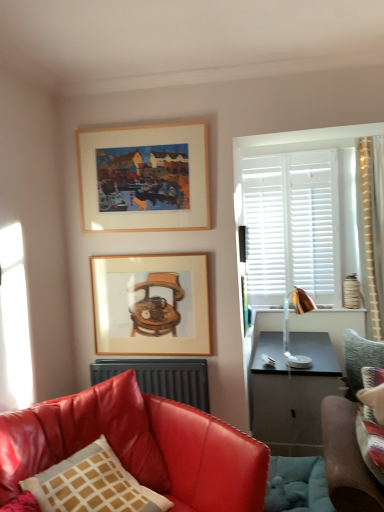
Question: In terms of height, does wooden frame at upper center, acting as the first picture frame starting from the top, look taller or shorter compared to shiny leather couch at lower left, which is the second studio couch from right to left?

Choices:
 (A) short
 (B) tall

Answer: (A)

Question: Visually, is wooden frame at upper center, acting as the first picture frame starting from the top, positioned to the left or to the right of shiny leather couch at lower left, the 1th studio couch when ordered from left to right?

Choices:
 (A) left
 (B) right

Answer: (B)

Question: Considering the real-world distances, which object is closest to the wooden framed picture at center, acting as the 1th picture frame starting from the bottom?

Choices:
 (A) velvet green sofa at right, the 1th studio couch in the right-to-left sequence
 (B) matte white pillow with brown grid at lower left
 (C) wooden frame at upper center, acting as the first picture frame starting from the top
 (D) copper metallic lamp at right
 (E) dark gray metallic radiator at lower center

Answer: (E)

Question: Based on their relative distances, which object is farther from the shiny leather couch at lower left, which is the second studio couch from right to left?

Choices:
 (A) dark gray metallic radiator at lower center
 (B) copper metallic lamp at right
 (C) wooden framed picture at center, the 2th picture frame viewed from the top
 (D) matte white pillow with brown grid at lower left
 (E) wooden frame at upper center, acting as the first picture frame starting from the top

Answer: (B)